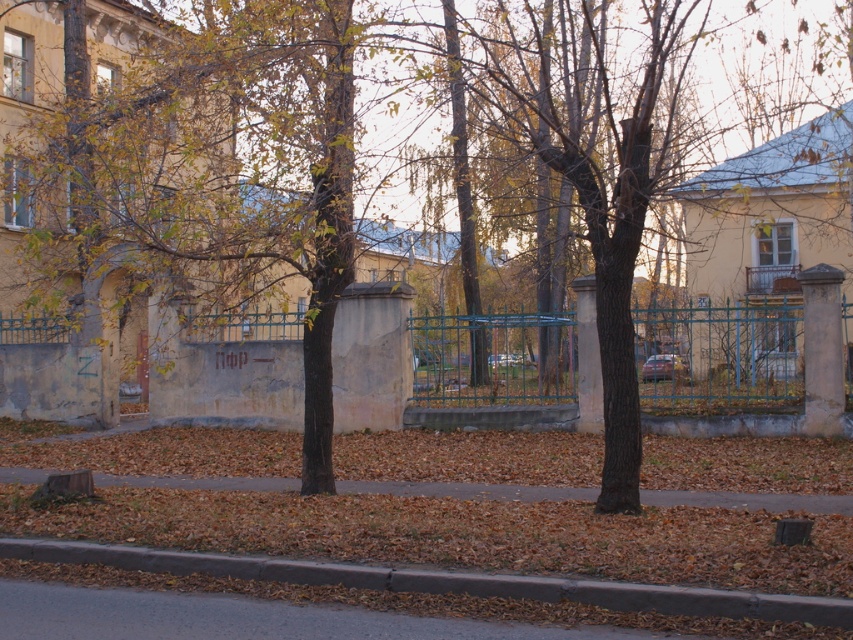
Question: In this image, where is green metal fence at center located relative to gray concrete curb at lower center?

Choices:
 (A) right
 (B) left

Answer: (A)

Question: Is brown bark tree at center wider than green metal fence at center?

Choices:
 (A) yes
 (B) no

Answer: (A)

Question: Observing the image, what is the correct spatial positioning of green leafy tree at center in reference to brown bark tree at center?

Choices:
 (A) left
 (B) right

Answer: (A)

Question: Among these points, which one is farthest from the camera?

Choices:
 (A) (722, 364)
 (B) (521, 589)

Answer: (A)

Question: Which point is farther to the camera?

Choices:
 (A) green metal fence at center
 (B) brown bark tree at center
 (C) gray concrete curb at lower center
 (D) green leafy tree at center

Answer: (A)

Question: Estimate the real-world distances between objects in this image. Which object is farther from the green metal fence at center?

Choices:
 (A) gray concrete curb at lower center
 (B) brown bark tree at center

Answer: (B)